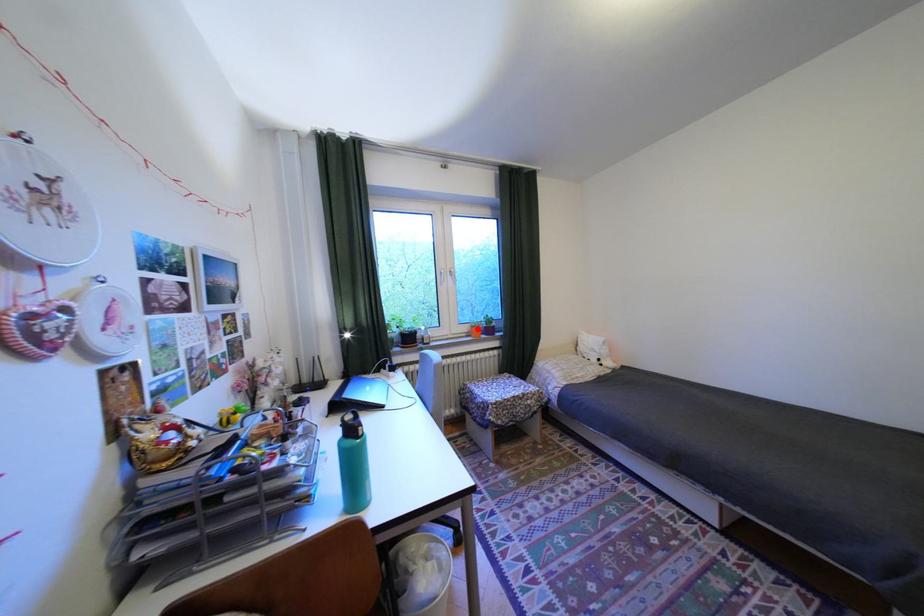
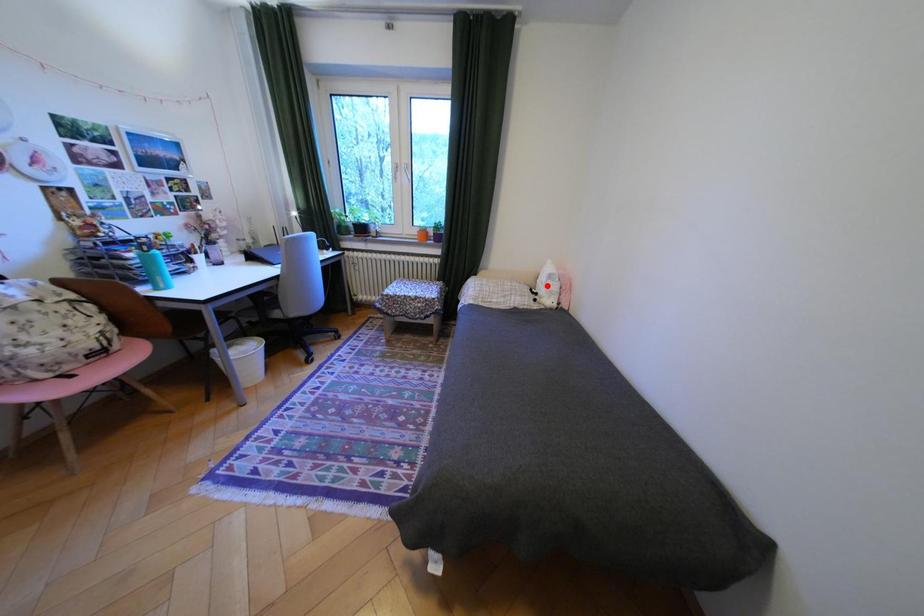
I am providing you with two images of the same scene from different viewpoints. A red point is marked on the first image and another point is marked on the second image. Do the highlighted points in image1 and image2 indicate the same real-world spot?

No